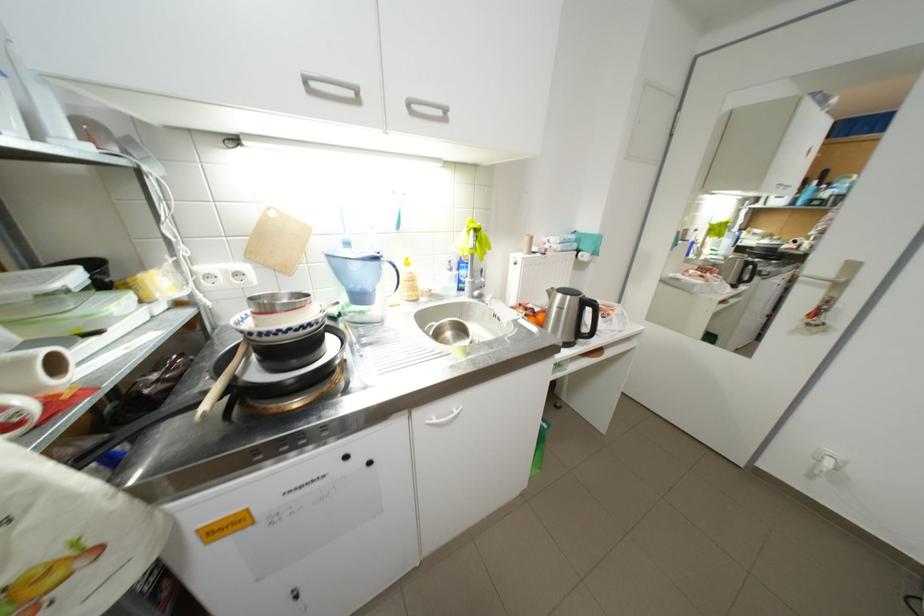
You are a GUI agent. You are given a task and a screenshot of the screen. Output one action in this format:
    pyautogui.click(x=<x>, y=<y>)
    Task: Click on the white patterned bowl
    Image resolution: width=924 pixels, height=616 pixels.
    Given the screenshot: What is the action you would take?
    pyautogui.click(x=277, y=326)